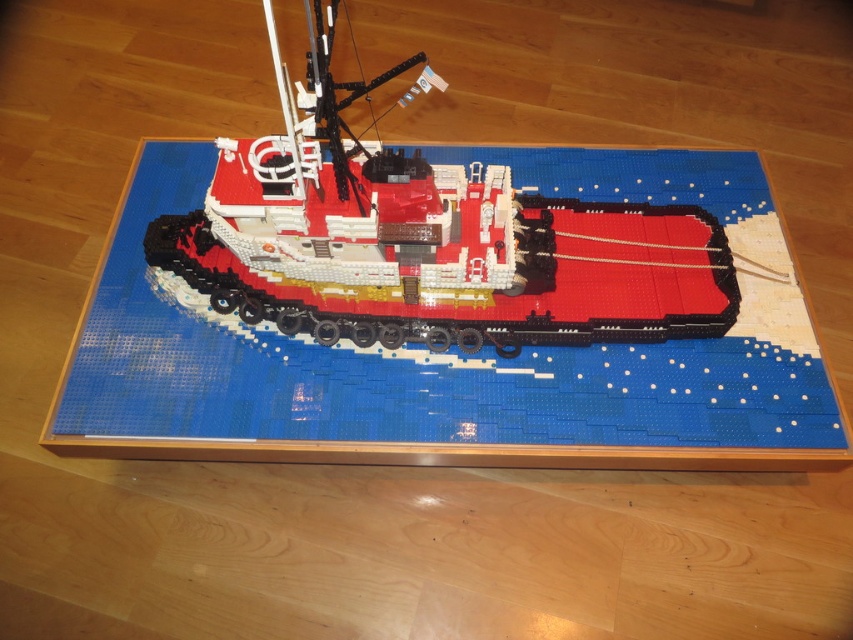
From the picture: Can you confirm if blue plastic table at center is wider than brick red plastic tugboat at center?

Indeed, blue plastic table at center has a greater width compared to brick red plastic tugboat at center.

Does blue plastic table at center appear over brick red plastic tugboat at center?

No.

At what (x,y) coordinates should I click in order to perform the action: click on blue plastic table at center. Please return your answer as a coordinate pair (x, y). This screenshot has width=853, height=640. Looking at the image, I should click on (467, 326).